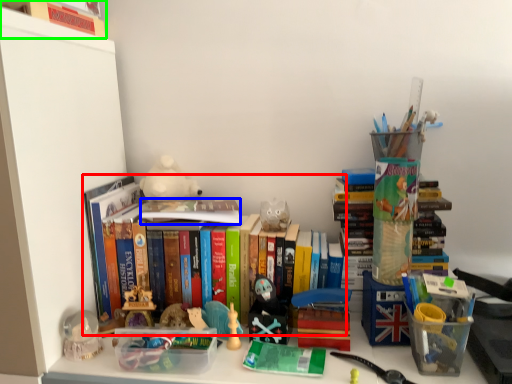
Question: Which object is the farthest from book (highlighted by a red box)? Choose among these: book (highlighted by a blue box) or book (highlighted by a green box).

Choices:
 (A) book
 (B) book

Answer: (B)